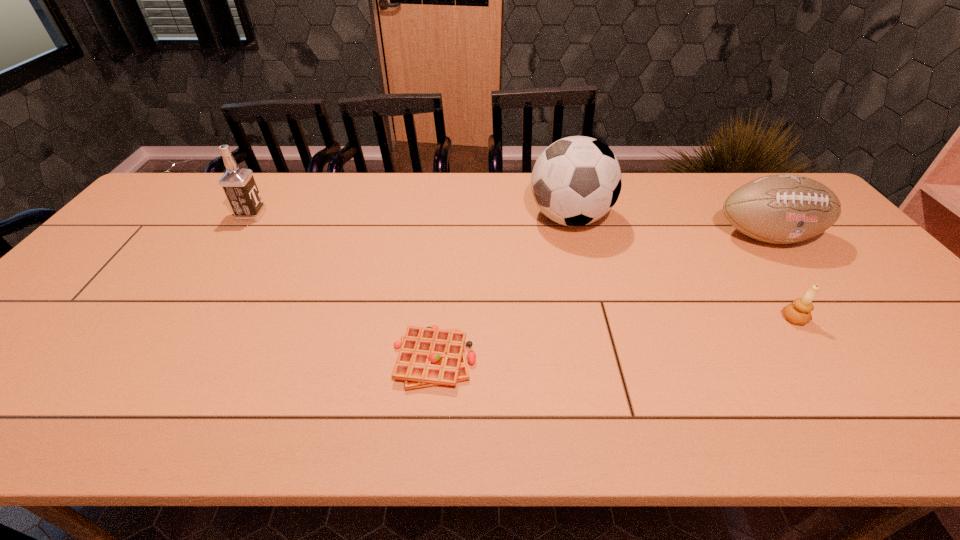
Locate an element on the screen. vacant space located 0.380m on the front label of the leftmost object is located at coordinates (384, 215).

At what (x,y) coordinates should I click in order to perform the action: click on free space located on the laces of the third tallest object. Please return your answer as a coordinate pair (x, y). Looking at the image, I should click on (808, 290).

Locate an element on the screen. The image size is (960, 540). vacant space located 0.190m on the front of the second nearest object is located at coordinates (850, 399).

This screenshot has width=960, height=540. I want to click on free space located 0.390m on the left of the waffle, so click(218, 358).

The height and width of the screenshot is (540, 960). Find the location of `soccer ball at the far edge`. soccer ball at the far edge is located at coordinates (575, 181).

This screenshot has height=540, width=960. Find the location of `vodka that is at the far edge`. vodka that is at the far edge is located at coordinates (239, 186).

Locate an element on the screen. The height and width of the screenshot is (540, 960). object present at the right edge is located at coordinates (781, 209).

Find the location of a particular element. This screenshot has height=540, width=960. vacant space at the far edge is located at coordinates (518, 180).

The width and height of the screenshot is (960, 540). In the image, there is a desktop. Identify the location of blank space at the near edge. (605, 431).

The image size is (960, 540). In order to click on free space between the third object from left to right and the nearest object in this screenshot , I will do `click(502, 288)`.